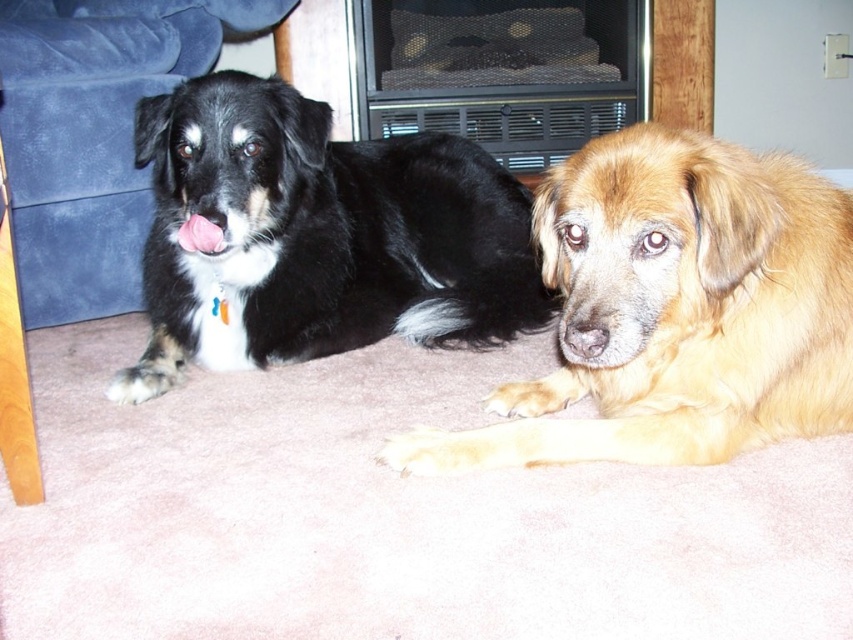
Measure the distance between golden fur dog at center and suede couch at left.

They are 3.72 feet apart.

Looking at this image, can you confirm if golden fur dog at center is wider than suede couch at left?

Yes.

Between point (779, 157) and point (33, 310), which one is positioned behind?

The point (33, 310) is more distant.

At what (x,y) coordinates should I click in order to perform the action: click on golden fur dog at center. Please return your answer as a coordinate pair (x, y). The image size is (853, 640). Looking at the image, I should click on (675, 308).

Is black soft fur dog at left to the left of suede couch at left from the viewer's perspective?

Incorrect, black soft fur dog at left is not on the left side of suede couch at left.

Between point (183, 280) and point (68, 269), which one is positioned behind?

Positioned behind is point (68, 269).

You are a GUI agent. You are given a task and a screenshot of the screen. Output one action in this format:
    pyautogui.click(x=<x>, y=<y>)
    Task: Click on the black soft fur dog at left
    
    Given the screenshot: What is the action you would take?
    (317, 236)

Can you confirm if golden fur dog at center is positioned to the right of black soft fur dog at left?

Correct, you'll find golden fur dog at center to the right of black soft fur dog at left.

Which is more to the right, golden fur dog at center or black soft fur dog at left?

Positioned to the right is golden fur dog at center.

Where is `golden fur dog at center`? golden fur dog at center is located at coordinates (675, 308).